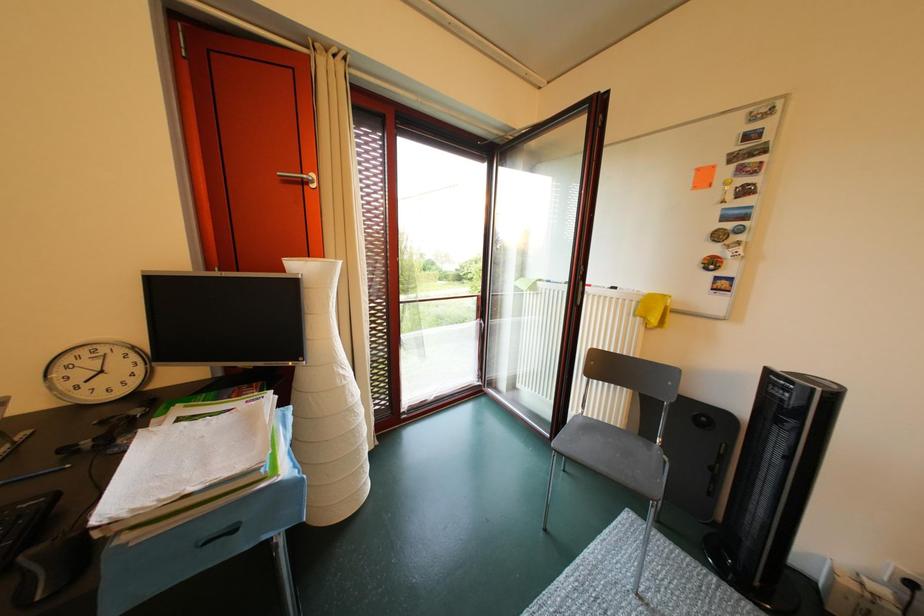
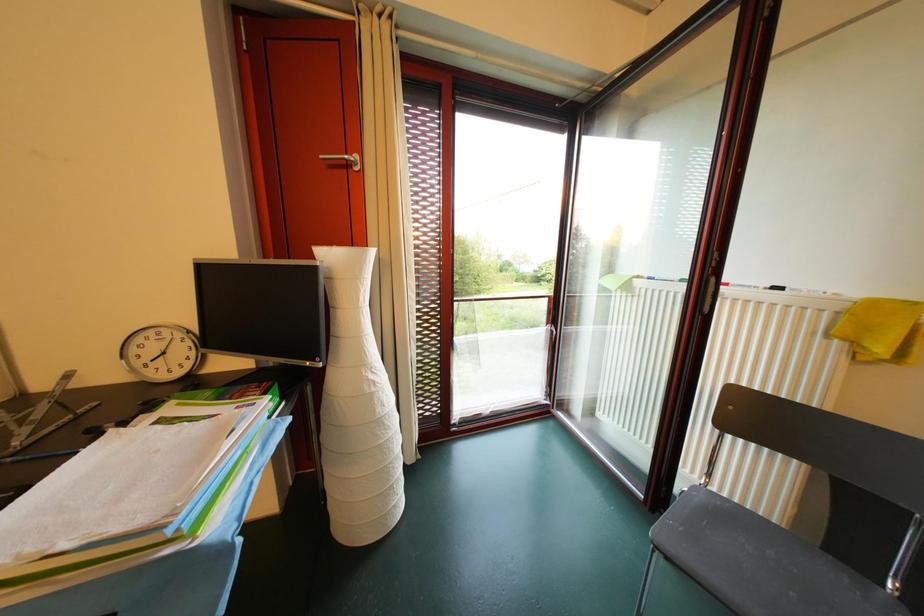
Question: What movement of the cameraman would produce the second image?

Choices:
 (A) Left
 (B) Right
 (C) Forward
 (D) Backward

Answer: (C)